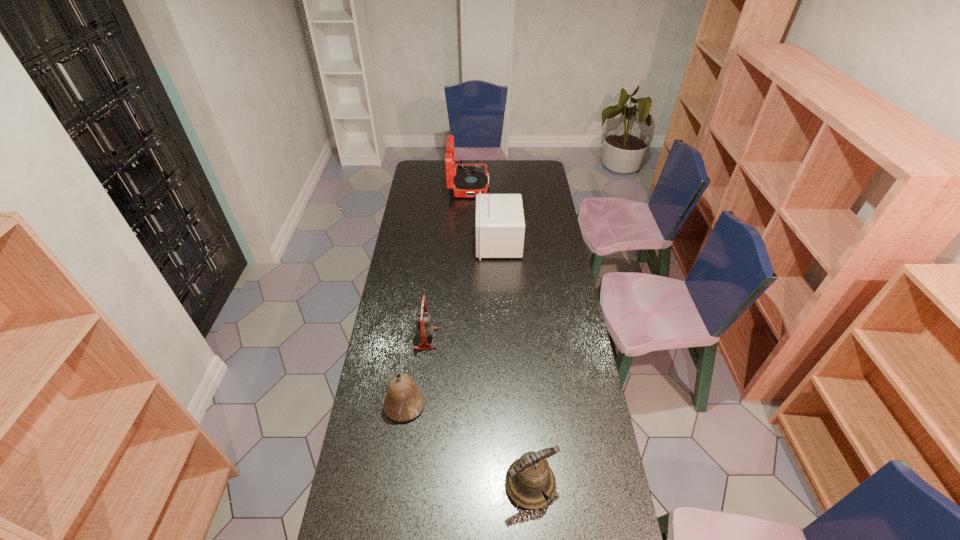
You are a GUI agent. You are given a task and a screenshot of the screen. Output one action in this format:
    pyautogui.click(x=<x>, y=<y>)
    Task: Click on the phonograph_record
    This screenshot has width=960, height=540.
    Given the screenshot: What is the action you would take?
    [469, 179]

You are a GUI agent. You are given a task and a screenshot of the screen. Output one action in this format:
    pyautogui.click(x=<x>, y=<y>)
    Task: Click on the second farthest object
    
    Given the screenshot: What is the action you would take?
    pyautogui.click(x=499, y=218)

The width and height of the screenshot is (960, 540). In order to click on the farthest bell in this screenshot , I will do `click(424, 328)`.

You are a GUI agent. You are given a task and a screenshot of the screen. Output one action in this format:
    pyautogui.click(x=<x>, y=<y>)
    Task: Click on the nearest object
    Image resolution: width=960 pixels, height=540 pixels.
    Given the screenshot: What is the action you would take?
    pyautogui.click(x=526, y=478)

Image resolution: width=960 pixels, height=540 pixels. I want to click on the rightmost bell, so click(x=526, y=478).

At what (x,y) coordinates should I click in order to perform the action: click on the second nearest bell. Please return your answer as a coordinate pair (x, y). This screenshot has height=540, width=960. Looking at the image, I should click on (404, 401).

At what (x,y) coordinates should I click in order to perform the action: click on vacant space located on the front-facing side of the phonograph_record. Please return your answer as a coordinate pair (x, y). The width and height of the screenshot is (960, 540). Looking at the image, I should click on (541, 185).

The width and height of the screenshot is (960, 540). Find the location of `vacant space located on the front-facing side of the first-aid kit`. vacant space located on the front-facing side of the first-aid kit is located at coordinates (411, 242).

What are the coordinates of `free space located 0.290m on the front-facing side of the first-aid kit` in the screenshot? It's located at (417, 242).

I want to click on vacant space situated 0.300m on the front-facing side of the first-aid kit, so click(x=415, y=242).